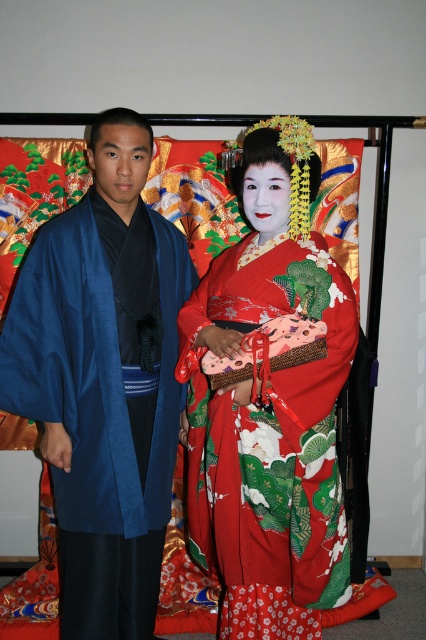
You are a photographer setting up for a traditional Japanese photo shoot. You need to position a stool between the blue silk kimono at left and the silky red kimono at center so that it doesn not block the shorter kimono. Where should you place the stool?

The blue silk kimono at left is taller than the silky red kimono at center. To avoid blocking the shorter kimono, place the stool between them but closer to the blue silk kimono at left so it doesn not obscure the view of the shorter silky red kimono at center.

From the picture: You are a photographer setting up for a photo shoot. You need to ensure that both the blue silk kimono at left and the silky red kimono at center are visible in the frame. Based on their positions, which kimono is covering part of the other?

The blue silk kimono at left is positioned over the silky red kimono at center, so it is covering part of it.

You are standing in front of a traditional Japanese scene with two people. There is a specific point at coordinates point (80,429). If you want to touch this point with your hand, which direction should you move? Please answer with either left, right, forward, or backward.

Since the point (80,429) is 1.78 meters away from you, you should move forward to reach it.